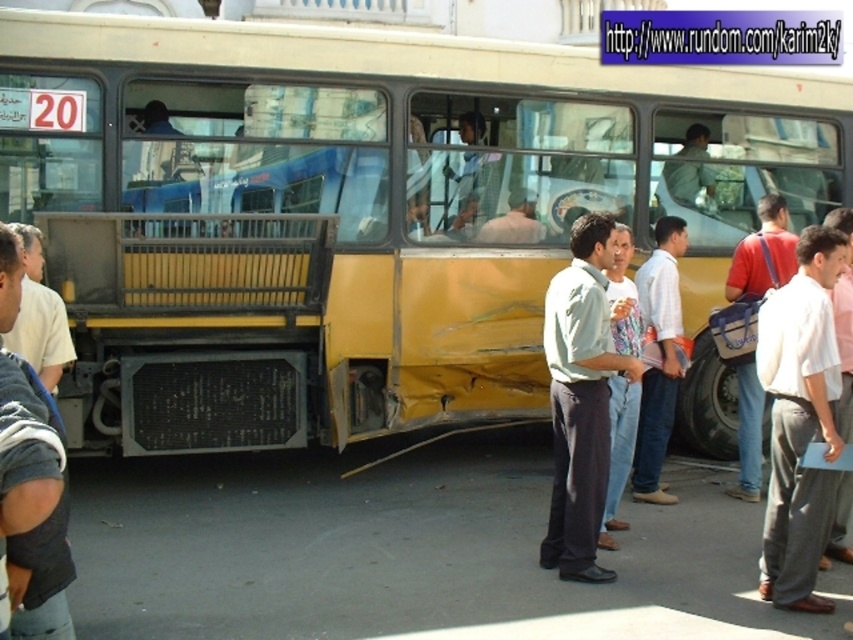
Question: Which point is closer to the camera?

Choices:
 (A) denim jacket at left
 (B) light brown leather jacket at center

Answer: (A)

Question: Which is farther from the white cotton shirt at center?

Choices:
 (A) light gray striped shirt at center
 (B) denim jacket at left

Answer: (B)

Question: Which object appears closest to the camera in this image?

Choices:
 (A) red fabric bag at center
 (B) white shirt at center
 (C) light green fabric shirt at center
 (D) white cotton shirt at center

Answer: (D)

Question: Can you confirm if white shirt at center is wider than light green shirt at center?

Choices:
 (A) yes
 (B) no

Answer: (B)

Question: Is light gray striped shirt at center behind light green shirt at center?

Choices:
 (A) yes
 (B) no

Answer: (B)

Question: Is light gray striped shirt at center to the left of light green shirt at center from the viewer's perspective?

Choices:
 (A) yes
 (B) no

Answer: (B)